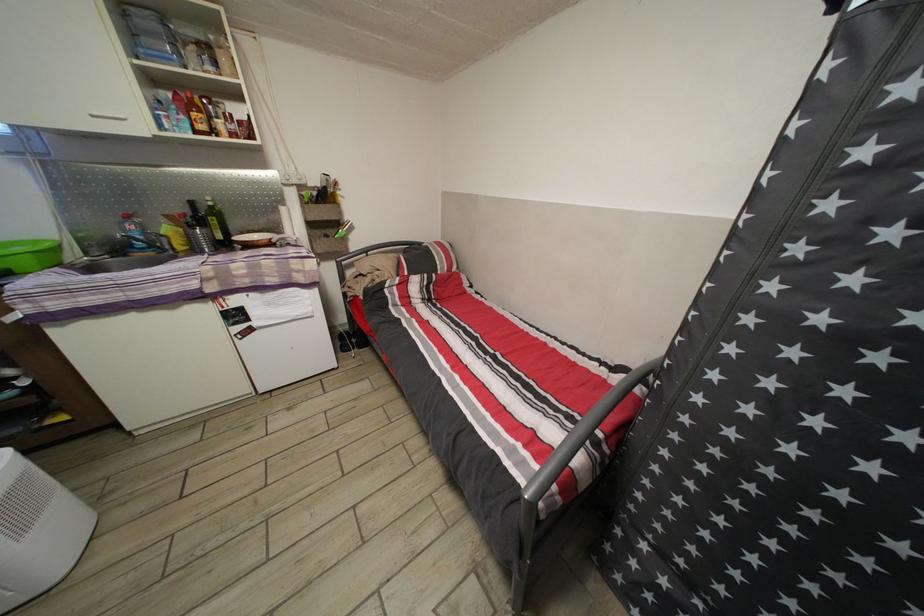
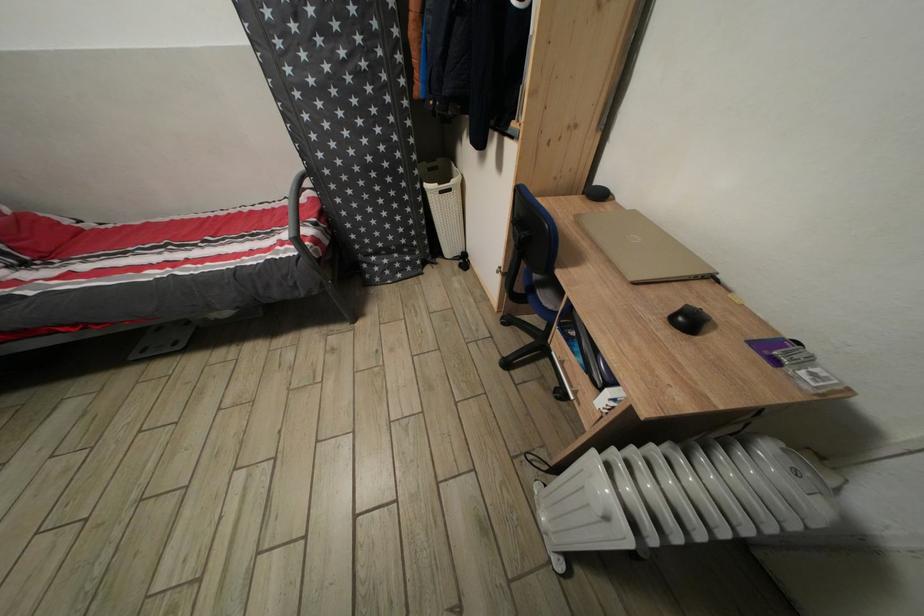
Locate, in the second image, the point that corresponds to point (601, 373) in the first image.

(294, 209)